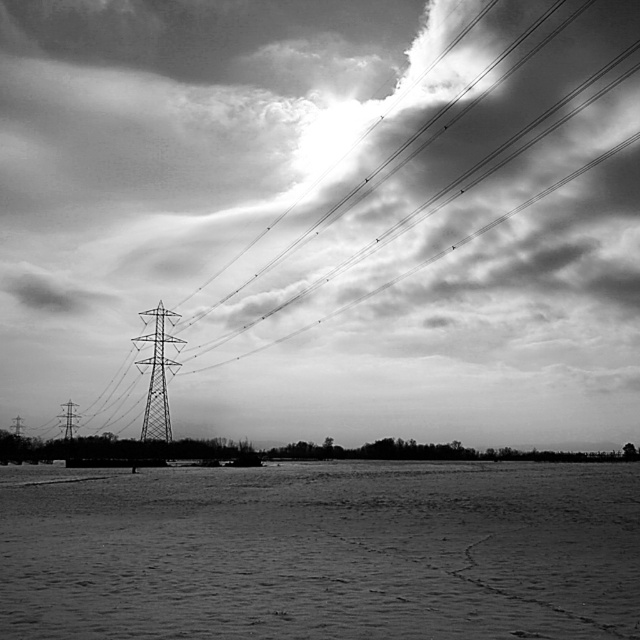
You are a photographer standing at the edge of the smooth sand at lower center and want to take a photo of the metallic grid tower at left. According to the scene, which direction should you face to capture the tower in your shot?

You should face to the left because the metallic grid tower at left is located to the left of the smooth sand at lower center where you are standing.

You are a photographer planning to capture a wide shot of the landscape. You notice the metallic grid tower at center and the metallic tower at left. Which tower should you focus on to ensure it takes up more space in your photo?

The metallic grid tower at center should be focused on because its width surpasses that of the metallic tower at left, making it larger and thus occupying more space in the photo.

You are a photographer aiming to capture the metallic grid tower at left and the smooth sand at lower center in a single frame. Given that your camera can only focus on objects within a 50 cm width range, will both objects fit within this range?

The smooth sand at lower center is wider than the metallic grid tower at left. However, since the camera can focus on objects within a 50 cm width range, both objects may fit if their combined widths are within 50 cm. But the exact answer depends on their individual widths, which are not provided in the description.